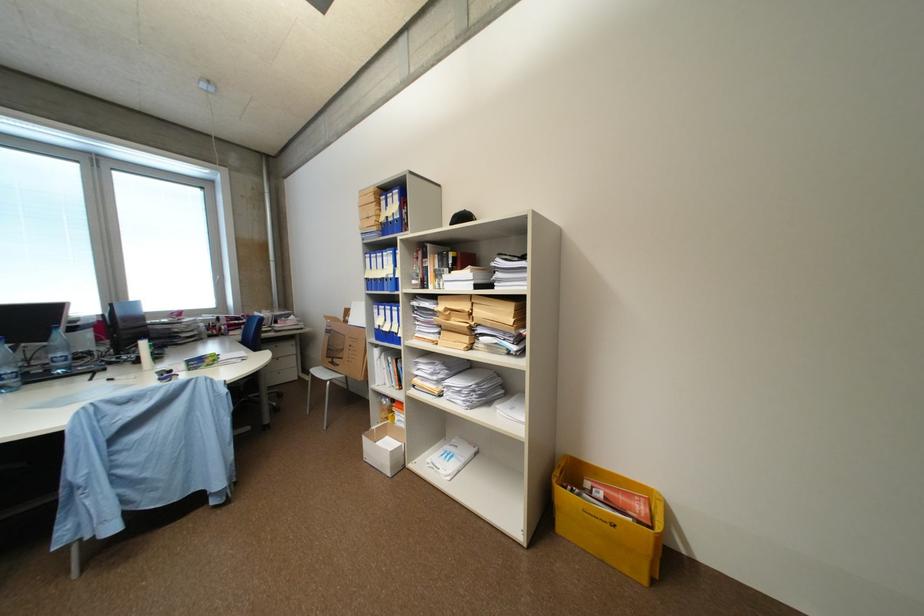
Which object does [345,346] point to?

It corresponds to the brown cardboard box in the image.